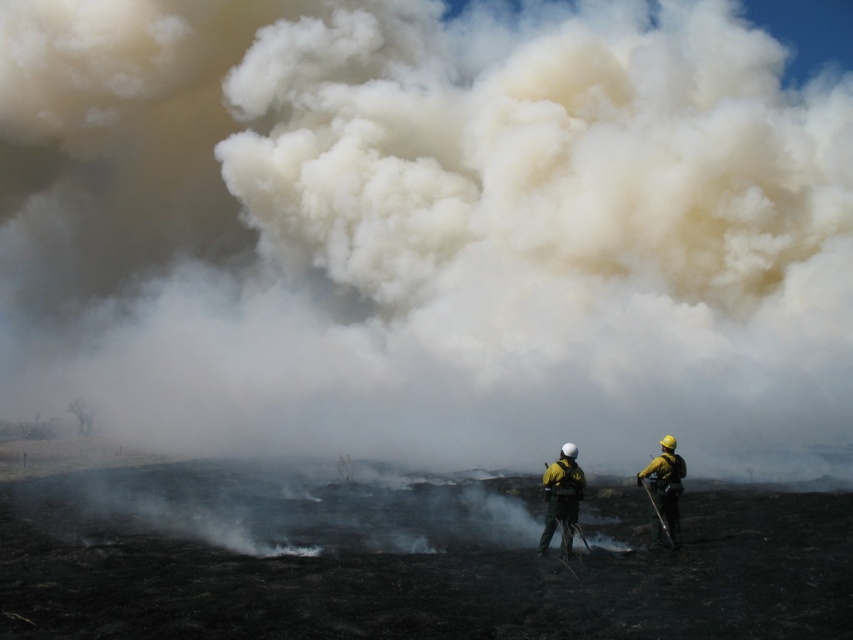
You are a firefighter trying to reach the source of the fire. You see the white smoke at center and the yellow hard hat at center. Which direction should you move to get closer to the fire source?

The white smoke at center is coming from the fire source, so you should move towards the white smoke at center. The yellow hard hat at center is worn by a firefighter, so moving towards it may lead you away from the fire source.

You are a firefighter assessing the scene. You see the white smoke at center and the yellow hard hat at right. Which object is higher from the ground?

The white smoke at center is positioned over the yellow hard hat at right, so it is higher from the ground.

You are a firefighter standing at the edge of the field. You notice two points marked in the scene. Which point is closer to you, point at coordinates (610,8) or point at coordinates (654,490)?

Point at coordinates (610,8) is closer to you because it is further to the viewer than point at coordinates (654,490).